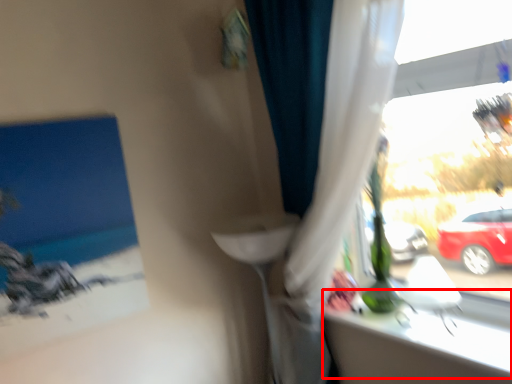
Question: From the image's perspective, where is window sill (annotated by the red box) located relative to curtain?

Choices:
 (A) above
 (B) below

Answer: (B)